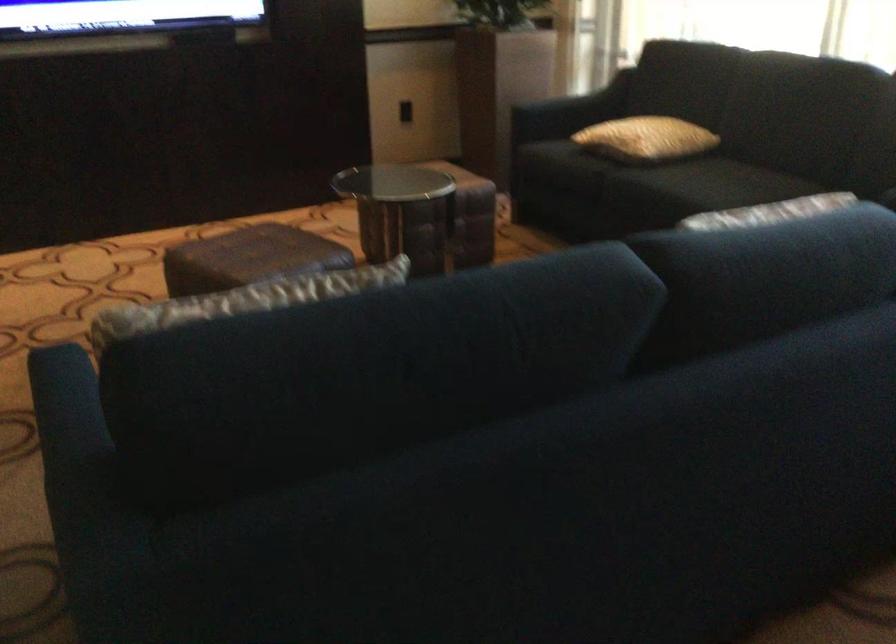
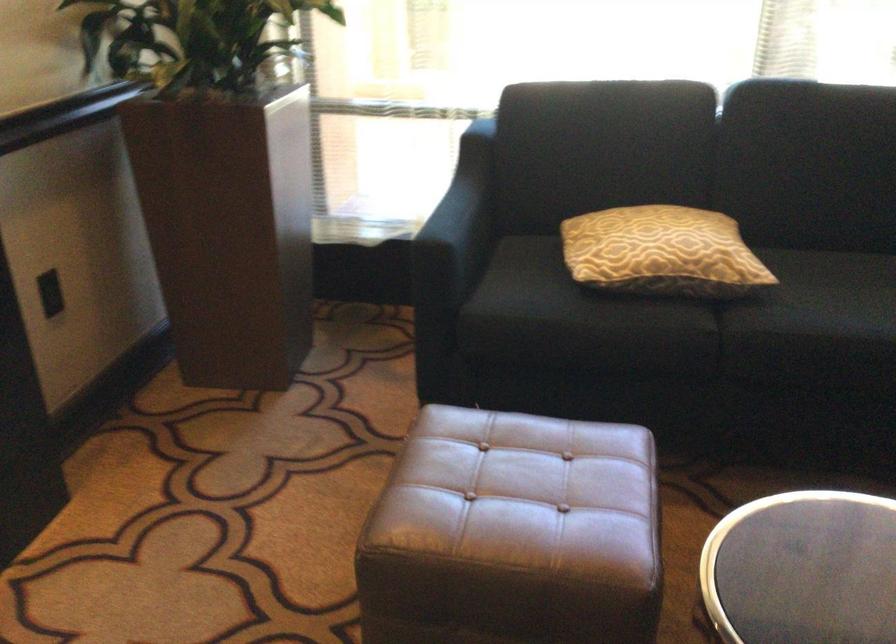
The point at (547, 102) is marked in the first image. Where is the corresponding point in the second image?

(458, 225)